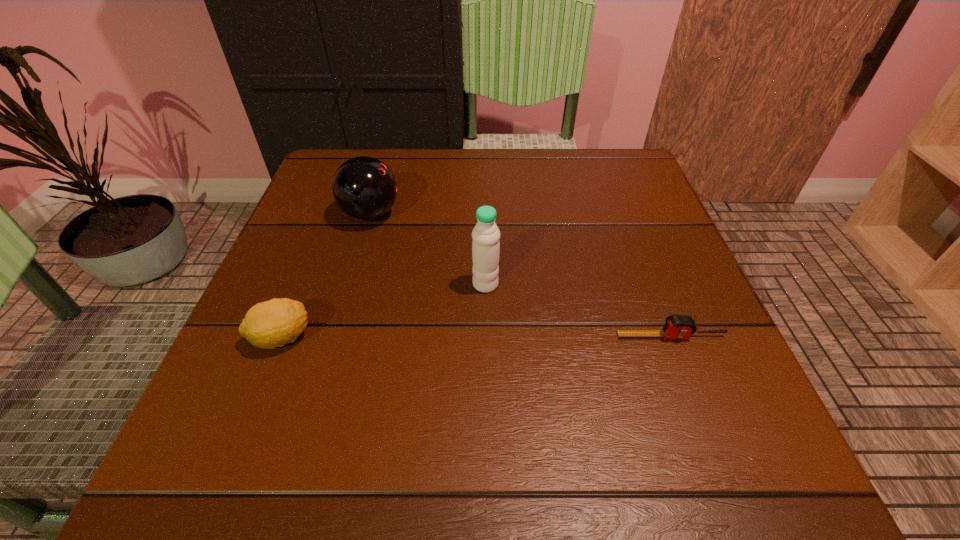
The image size is (960, 540). In order to click on water bottle in this screenshot , I will do `click(485, 245)`.

Find the location of a particular element. the third object from left to right is located at coordinates (485, 245).

This screenshot has height=540, width=960. In order to click on bowling ball in this screenshot , I will do `click(364, 188)`.

Where is `the second tallest object`? This screenshot has height=540, width=960. the second tallest object is located at coordinates (364, 188).

I want to click on lemon, so click(274, 323).

Image resolution: width=960 pixels, height=540 pixels. Identify the location of the rightmost object. (676, 326).

Image resolution: width=960 pixels, height=540 pixels. I want to click on the shortest object, so click(676, 326).

Locate an element on the screen. The width and height of the screenshot is (960, 540). vacant space located on the left of the water bottle is located at coordinates (418, 285).

Locate an element on the screen. Image resolution: width=960 pixels, height=540 pixels. vacant space located 0.390m on the surface of the third shortest object near the finger holes is located at coordinates (580, 214).

Find the location of a particular element. free space located at the stem end of the third tallest object is located at coordinates (447, 338).